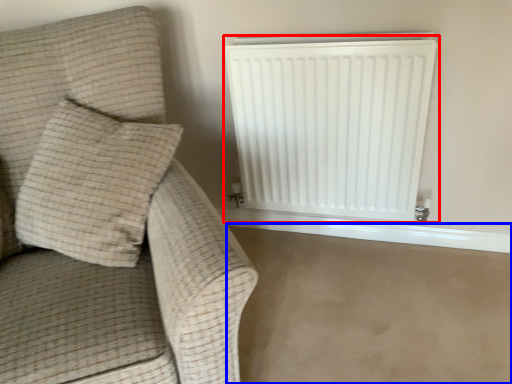
Question: Among these objects, which one is farthest to the camera, radiator (highlighted by a red box) or concrete (highlighted by a blue box)?

Choices:
 (A) radiator
 (B) concrete

Answer: (A)